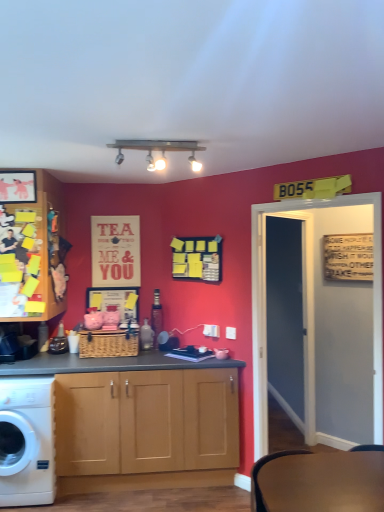
Question: Is matte black picture frame at upper left closer to the viewer compared to white plastic power outlet at center, which is the 2th power outlet in left-to-right order?

Choices:
 (A) no
 (B) yes

Answer: (B)

Question: Is matte black picture frame at upper left smaller than white plastic power outlet at center, positioned as the first power outlet in front-to-back order?

Choices:
 (A) no
 (B) yes

Answer: (A)

Question: Is matte black picture frame at upper left aimed at white plastic power outlet at center, positioned as the first power outlet in front-to-back order?

Choices:
 (A) yes
 (B) no

Answer: (B)

Question: Is matte black picture frame at upper left placed right next to white plastic power outlet at center, positioned as the first power outlet in front-to-back order?

Choices:
 (A) yes
 (B) no

Answer: (B)

Question: From the image's perspective, is matte black picture frame at upper left above white plastic power outlet at center, positioned as the first power outlet in front-to-back order?

Choices:
 (A) no
 (B) yes

Answer: (B)

Question: Considering the relative sizes of matte black picture frame at upper left and white plastic power outlet at center, acting as the first power outlet starting from the right, in the image provided, is matte black picture frame at upper left thinner than white plastic power outlet at center, acting as the first power outlet starting from the right,?

Choices:
 (A) yes
 (B) no

Answer: (B)

Question: Is brown wooden table at lower right thinner than white plastic power outlet at center, acting as the first power outlet starting from the right?

Choices:
 (A) yes
 (B) no

Answer: (B)

Question: Considering the relative positions of brown wooden table at lower right and white plastic power outlet at center, positioned as the first power outlet in front-to-back order, in the image provided, is brown wooden table at lower right to the left of white plastic power outlet at center, positioned as the first power outlet in front-to-back order, from the viewer's perspective?

Choices:
 (A) yes
 (B) no

Answer: (B)

Question: Considering the relative sizes of brown wooden table at lower right and white plastic power outlet at center, acting as the first power outlet starting from the right, in the image provided, is brown wooden table at lower right taller than white plastic power outlet at center, acting as the first power outlet starting from the right,?

Choices:
 (A) yes
 (B) no

Answer: (A)

Question: Is brown wooden table at lower right smaller than white plastic power outlet at center, acting as the first power outlet starting from the right?

Choices:
 (A) no
 (B) yes

Answer: (A)

Question: Is brown wooden table at lower right shorter than white plastic power outlet at center, positioned as the first power outlet in front-to-back order?

Choices:
 (A) yes
 (B) no

Answer: (B)

Question: From a real-world perspective, does brown wooden table at lower right stand above white plastic power outlet at center, which is the 2th power outlet in left-to-right order?

Choices:
 (A) yes
 (B) no

Answer: (B)

Question: Does woven brown picnic basket at center come in front of matte paper poster at upper center?

Choices:
 (A) no
 (B) yes

Answer: (B)